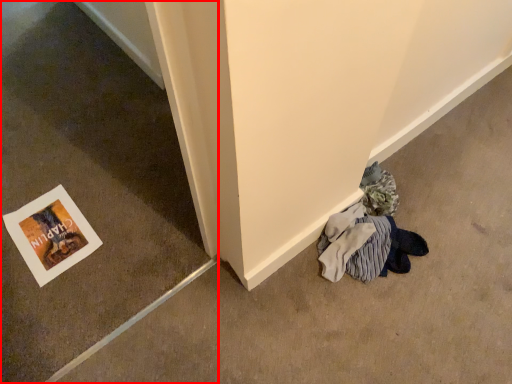
Question: From the image's perspective, what is the correct spatial relationship of concrete (annotated by the red box) in relation to picture frame?

Choices:
 (A) below
 (B) above

Answer: (A)